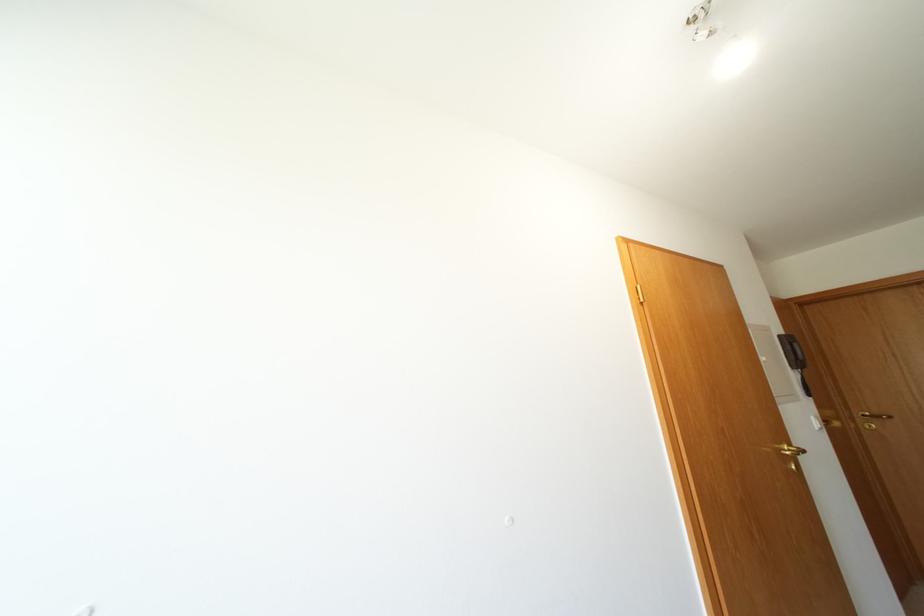
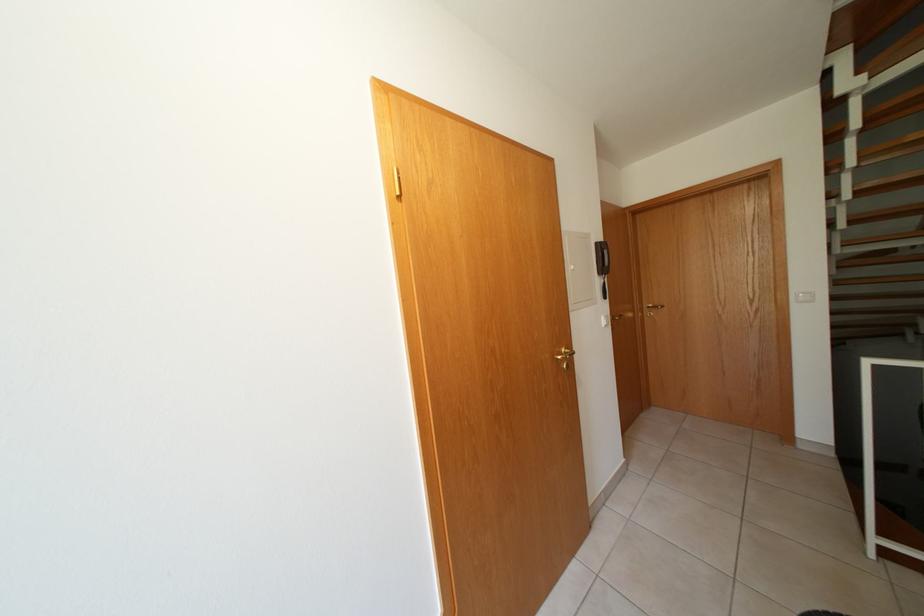
The point at (x=801, y=381) is marked in the first image. Where is the corresponding point in the second image?

(606, 286)